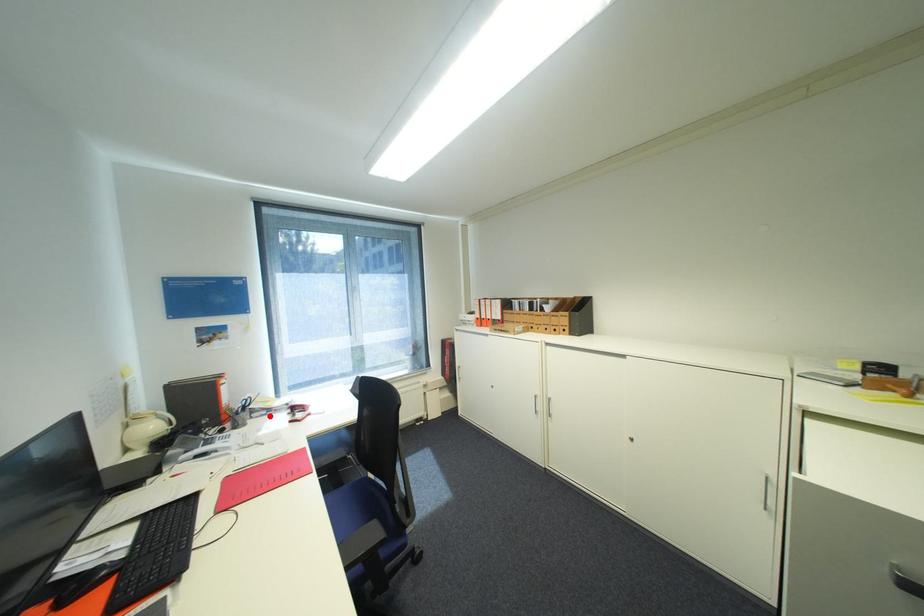
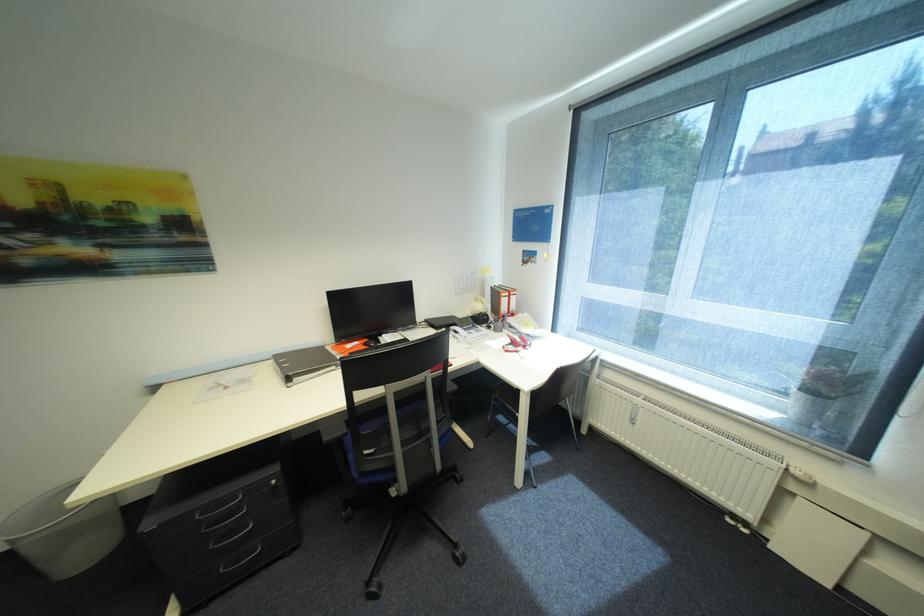
The point at the highlighted location is marked in the first image. Where is the corresponding point in the second image?

(521, 333)